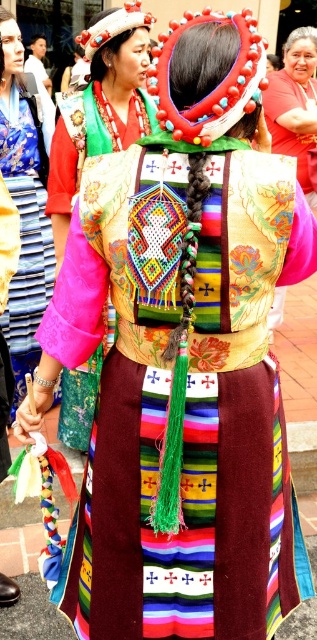
You are standing in the vibrant cultural scene and want to move from point A to point B. Point A is at coordinates point (x=77, y=426) and point B is at coordinates point (x=265, y=118). Given that you can only move forward in a straight line, will you encounter any obstacles between these two points?

Point (x=77, y=426) is in front of point (x=265, y=118), so moving from point A to point B in a straight line would mean you are moving backward, which is not possible. Therefore, you will not encounter any obstacles between these two points since you cannot move in that direction.

What is the exact location of the velvet pink blouse at center in the image?

The velvet pink blouse at center is located at point (24, 209).